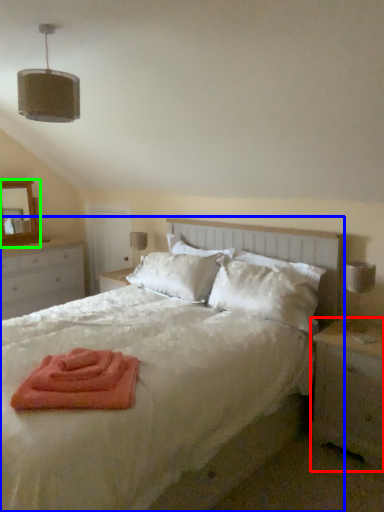
Question: Which is nearer to the nightstand (highlighted by a red box)? bed (highlighted by a blue box) or mirror (highlighted by a green box).

Choices:
 (A) bed
 (B) mirror

Answer: (A)